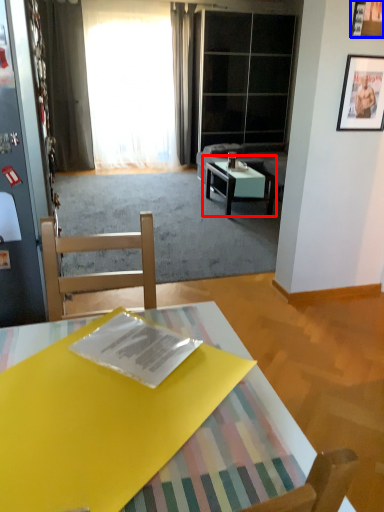
Question: Which object appears farthest to the camera in this image, coffee table (highlighted by a red box) or picture frame (highlighted by a blue box)?

Choices:
 (A) coffee table
 (B) picture frame

Answer: (A)